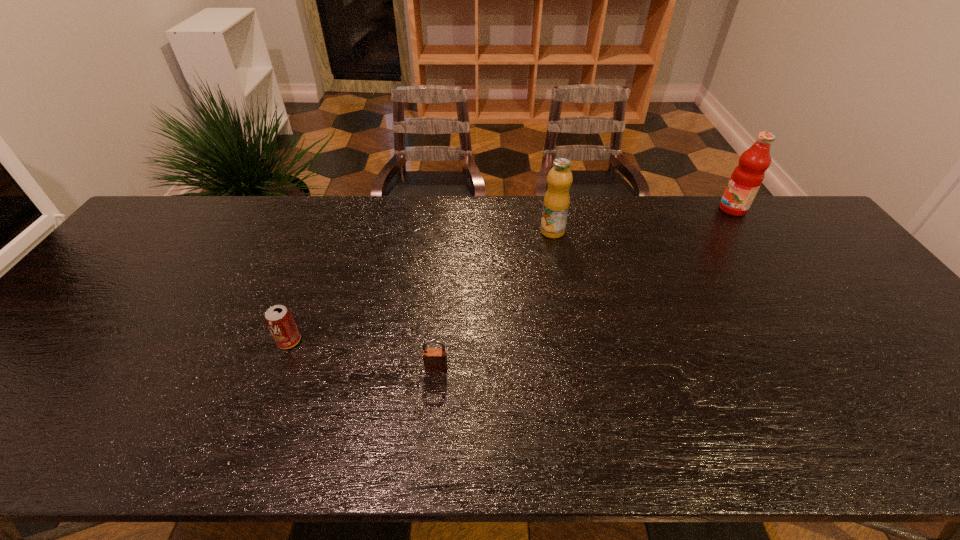
The width and height of the screenshot is (960, 540). In order to click on the farther fruit juice in this screenshot , I will do `click(746, 179)`.

This screenshot has width=960, height=540. I want to click on the rightmost object, so click(x=746, y=179).

Find the location of a particular element. This screenshot has height=540, width=960. the left fruit juice is located at coordinates (556, 202).

The image size is (960, 540). In order to click on the third object from left to right in this screenshot , I will do `click(556, 202)`.

The image size is (960, 540). I want to click on the third farthest object, so click(x=278, y=319).

The width and height of the screenshot is (960, 540). Identify the location of soda can. (278, 319).

Locate an element on the screen. The width and height of the screenshot is (960, 540). the nearest object is located at coordinates (435, 359).

At what (x,y) coordinates should I click in order to perform the action: click on padlock. Please return your answer as a coordinate pair (x, y). This screenshot has height=540, width=960. Looking at the image, I should click on (435, 359).

What are the coordinates of `vacant space located on the front label of the farthest object` in the screenshot? It's located at (642, 209).

Where is `vacant space located on the front label of the farthest object`? vacant space located on the front label of the farthest object is located at coordinates (608, 209).